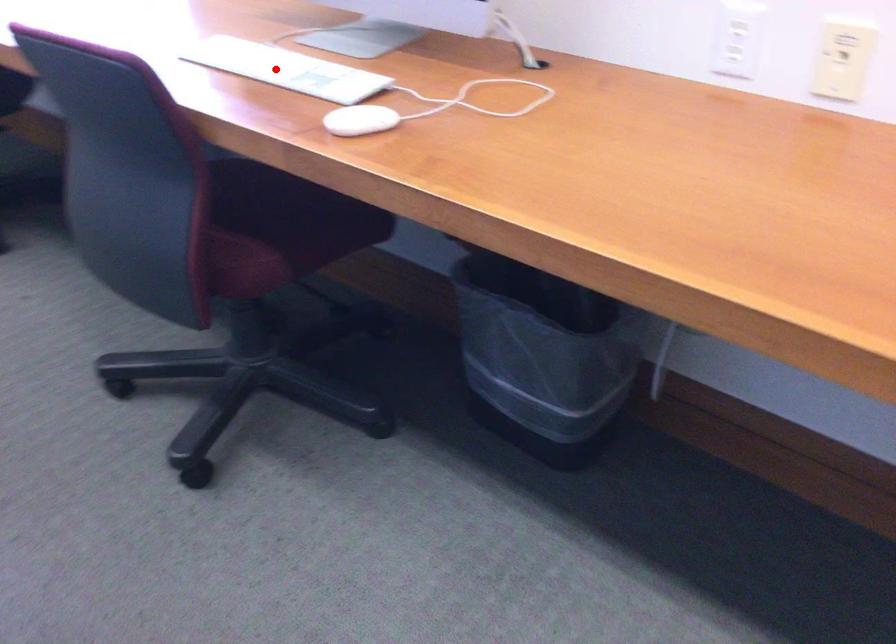
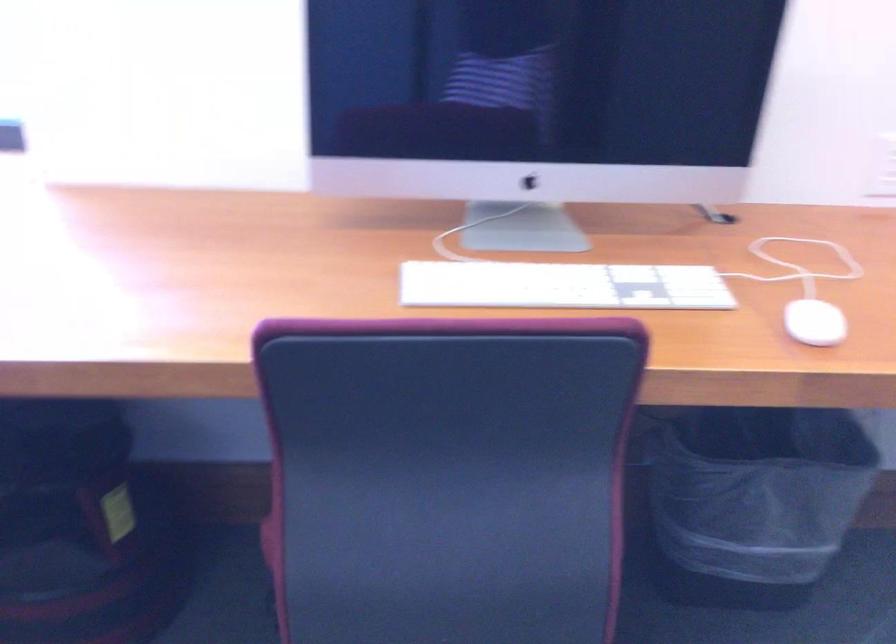
Where in the second image is the point corresponding to the highlighted location from the first image?

(562, 285)